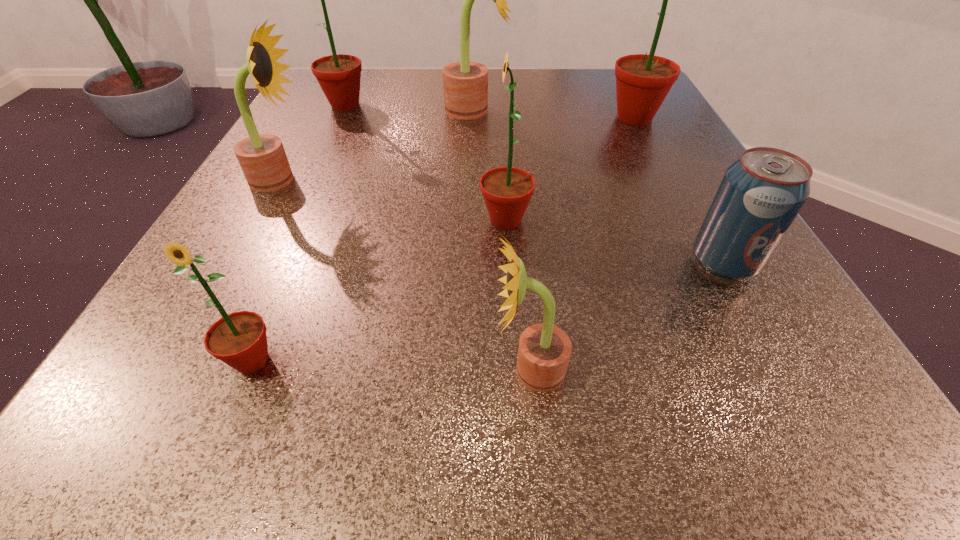
What are the coordinates of `the third nearest object` in the screenshot? It's located at (761, 193).

The width and height of the screenshot is (960, 540). Find the location of `pop soda`. pop soda is located at coordinates (761, 193).

The image size is (960, 540). Identify the location of vacant region located on the face of the rightmost sunflower. (491, 117).

Find the location of `vacant region located on the face of the rightmost sunflower`. vacant region located on the face of the rightmost sunflower is located at coordinates (516, 117).

Locate an element on the screen. vacant area situated on the face of the rightmost sunflower is located at coordinates (556, 117).

Find the location of a particular element. Image resolution: width=960 pixels, height=540 pixels. free space located on the face of the biggest yellow sunflower is located at coordinates (546, 110).

Identify the location of blank space located 0.120m on the face of the third smallest green sunflower. This screenshot has height=540, width=960. (325, 146).

Locate an element on the screen. vacant space positioned on the face of the second smallest yellow sunflower is located at coordinates (523, 180).

What are the coordinates of `vacant space situated on the face of the second smallest green sunflower` in the screenshot? It's located at (440, 220).

Identify the location of free space located on the face of the second smallest green sunflower. (265, 220).